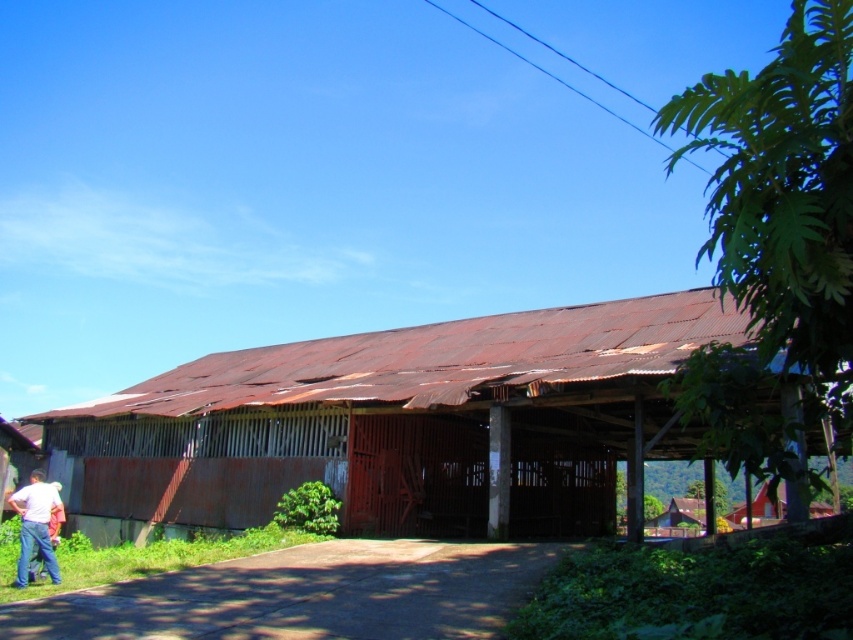
Does rusty corrugated metal barn at center have a lesser height compared to white matte shirt at lower left?

In fact, rusty corrugated metal barn at center may be taller than white matte shirt at lower left.

Is point (358, 522) positioned in front of point (32, 496)?

No, it is behind (32, 496).

This screenshot has width=853, height=640. I want to click on rusty corrugated metal barn at center, so click(x=392, y=419).